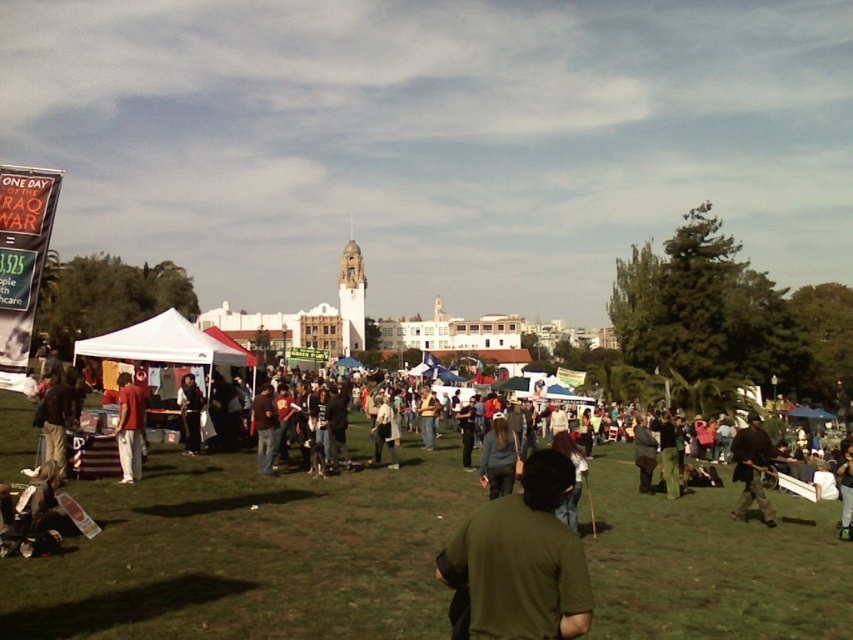
Question: Can you confirm if green matte shirt at center is positioned to the left of dark gray hoodie at center?

Choices:
 (A) no
 (B) yes

Answer: (A)

Question: Which point is closer to the camera?

Choices:
 (A) dark brown leather jacket at center
 (B) dark gray hoodie at center

Answer: (A)

Question: Can you confirm if green matte shirt at center is positioned above dark gray hoodie at center?

Choices:
 (A) yes
 (B) no

Answer: (B)

Question: Which point is farther to the camera?

Choices:
 (A) dark gray hoodie at center
 (B) dark brown leather jacket at center
 (C) dark gray jacket at center

Answer: (A)

Question: Considering the real-world distances, which object is closest to the dark brown leather jacket at center?

Choices:
 (A) dark gray pants at center
 (B) green grassy field at center

Answer: (B)

Question: Considering the relative positions of matte red shirt at center and dark brown hair at center in the image provided, where is matte red shirt at center located with respect to dark brown hair at center?

Choices:
 (A) right
 (B) left

Answer: (B)